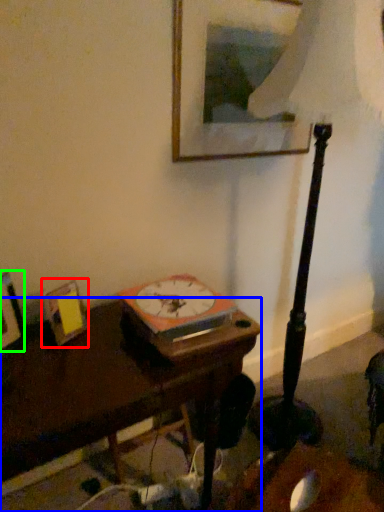
Question: Considering the real-world distances, which object is farthest from picture frame (highlighted by a red box)? table (highlighted by a blue box) or picture frame (highlighted by a green box)?

Choices:
 (A) table
 (B) picture frame

Answer: (A)